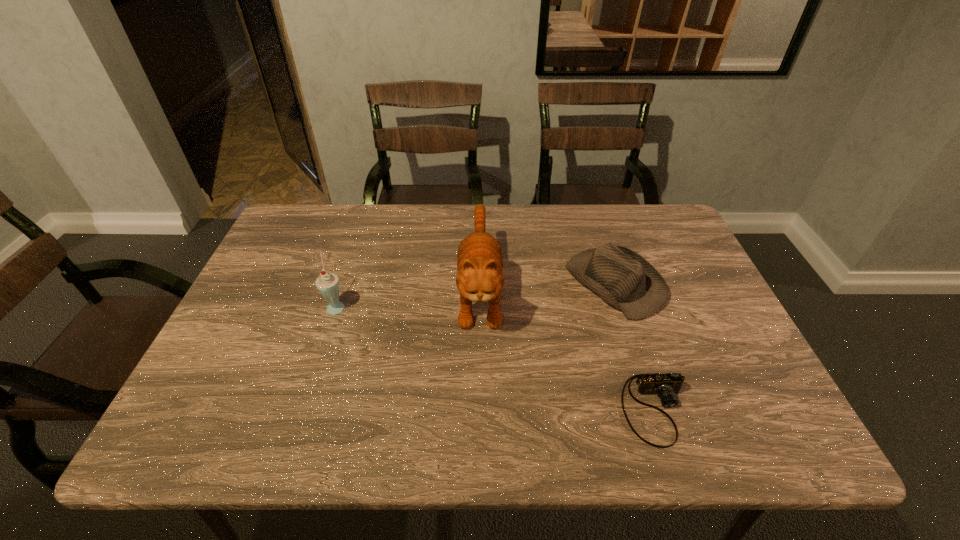
Find the location of a particular element. This screenshot has height=540, width=960. unoccupied area between the third object from right to left and the camera is located at coordinates (567, 349).

The height and width of the screenshot is (540, 960). What are the coordinates of `the third closest object relative to the camera` in the screenshot? It's located at (327, 283).

Find the location of a particular element. The width and height of the screenshot is (960, 540). object that is the second closest to the third object from right to left is located at coordinates (666, 386).

Image resolution: width=960 pixels, height=540 pixels. I want to click on vacant region that satisfies the following two spatial constraints: 1. on the face of the cat; 2. on the straw side of the milkshake, so click(480, 306).